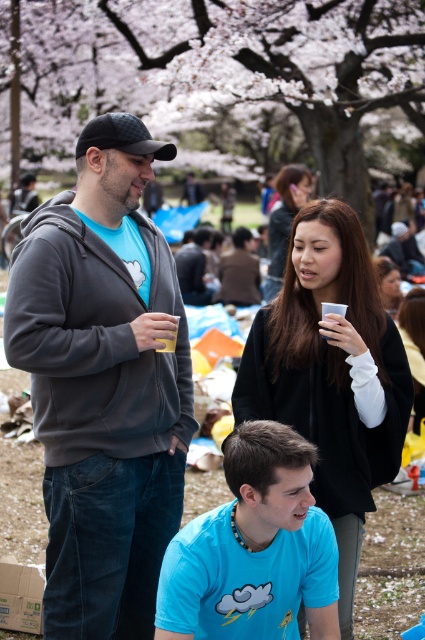
Does point (283, 227) come closer to viewer compared to point (176, 266)?

Yes, point (283, 227) is in front of point (176, 266).

Is matte black hair at center above dark gray hoodie at center?

No.

Does point (274, 212) come closer to viewer compared to point (175, 260)?

No, it is behind (175, 260).

Locate an element on the screen. Image resolution: width=425 pixels, height=640 pixels. matte black hair at center is located at coordinates (283, 221).

Between point (305, 205) and point (289, 168), which one is positioned in front?

Point (305, 205) is more forward.

Can you confirm if black matte sweater at upper center is thinner than matte black hair at center?

No.

Between point (337, 262) and point (272, 275), which one is positioned behind?

The point (272, 275) is more distant.

Find the location of a particular element. This screenshot has height=640, width=425. black matte sweater at upper center is located at coordinates (331, 374).

Which is more to the left, dark brown leather jacket at center or dark gray hoodie at center?

dark gray hoodie at center

How distant is dark brown leather jacket at center from dark gray hoodie at center?

dark brown leather jacket at center is 56.91 centimeters from dark gray hoodie at center.

You are a GUI agent. You are given a task and a screenshot of the screen. Output one action in this format:
    pyautogui.click(x=<x>, y=<y>)
    Task: Click on the dark brown leather jacket at center
    The width and height of the screenshot is (425, 640).
    Given the screenshot: What is the action you would take?
    pyautogui.click(x=238, y=273)